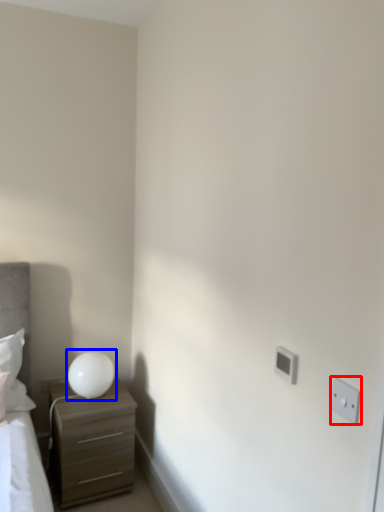
Question: Among these objects, which one is farthest to the camera, electric outlet (highlighted by a red box) or table lamp (highlighted by a blue box)?

Choices:
 (A) electric outlet
 (B) table lamp

Answer: (B)